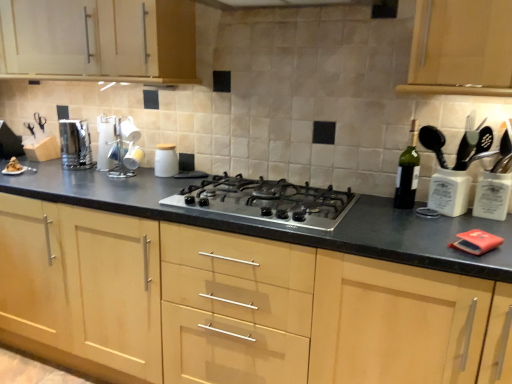
Question: Is matte wood cabinet at upper left, which ranks as the 2th cabinetry in bottom-to-top order, touching white ceramic jar at center, the second kitchen appliance from the left?

Choices:
 (A) yes
 (B) no

Answer: (B)

Question: From a real-world perspective, is matte wood cabinet at upper left, which appears as the 1th cabinetry when viewed from the top, on top of white ceramic jar at center, the first kitchen appliance from the right?

Choices:
 (A) yes
 (B) no

Answer: (A)

Question: Are matte wood cabinet at upper left, which ranks as the 2th cabinetry in bottom-to-top order, and white ceramic jar at center, the second kitchen appliance from the left, located far from each other?

Choices:
 (A) no
 (B) yes

Answer: (A)

Question: Can you confirm if matte wood cabinet at upper left, which appears as the 1th cabinetry when viewed from the top, is shorter than white ceramic jar at center, the second kitchen appliance from the left?

Choices:
 (A) no
 (B) yes

Answer: (A)

Question: Does matte wood cabinet at upper left, which appears as the 1th cabinetry when viewed from the top, have a greater height compared to white ceramic jar at center, the second kitchen appliance from the left?

Choices:
 (A) yes
 (B) no

Answer: (A)

Question: Does matte wood cabinet at upper left, which appears as the 1th cabinetry when viewed from the top, lie in front of white ceramic jar at center, the first kitchen appliance from the right?

Choices:
 (A) no
 (B) yes

Answer: (B)

Question: Is polished stainless steel toaster at left, the 2th kitchen appliance when ordered from right to left, completely or partially outside of white ceramic jar at center, the second kitchen appliance from the left?

Choices:
 (A) no
 (B) yes

Answer: (B)

Question: Does polished stainless steel toaster at left, the 2th kitchen appliance when ordered from right to left, have a larger size compared to white ceramic jar at center, the second kitchen appliance from the left?

Choices:
 (A) no
 (B) yes

Answer: (B)

Question: From the image's perspective, does polished stainless steel toaster at left, positioned as the first kitchen appliance in left-to-right order, appear lower than white ceramic jar at center, the first kitchen appliance from the right?

Choices:
 (A) yes
 (B) no

Answer: (B)

Question: Is polished stainless steel toaster at left, the 2th kitchen appliance when ordered from right to left, oriented towards white ceramic jar at center, the first kitchen appliance from the right?

Choices:
 (A) yes
 (B) no

Answer: (B)

Question: From a real-world perspective, is polished stainless steel toaster at left, the 2th kitchen appliance when ordered from right to left, located higher than white ceramic jar at center, the first kitchen appliance from the right?

Choices:
 (A) yes
 (B) no

Answer: (A)

Question: Does polished stainless steel toaster at left, positioned as the first kitchen appliance in left-to-right order, have a lesser height compared to white ceramic jar at center, the first kitchen appliance from the right?

Choices:
 (A) no
 (B) yes

Answer: (A)

Question: From a real-world perspective, does satin silver gas stove at center stand above green glass bottle at right?

Choices:
 (A) no
 (B) yes

Answer: (A)